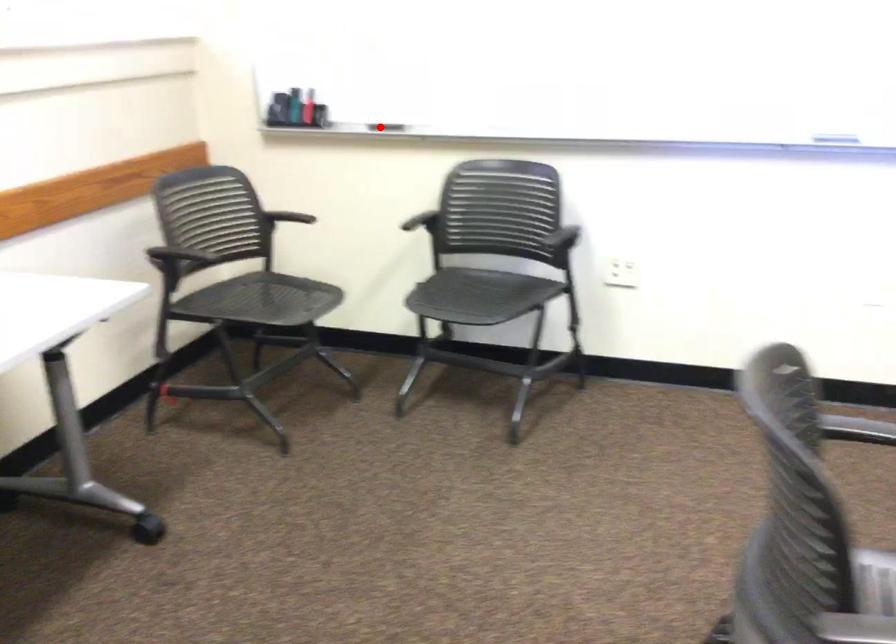
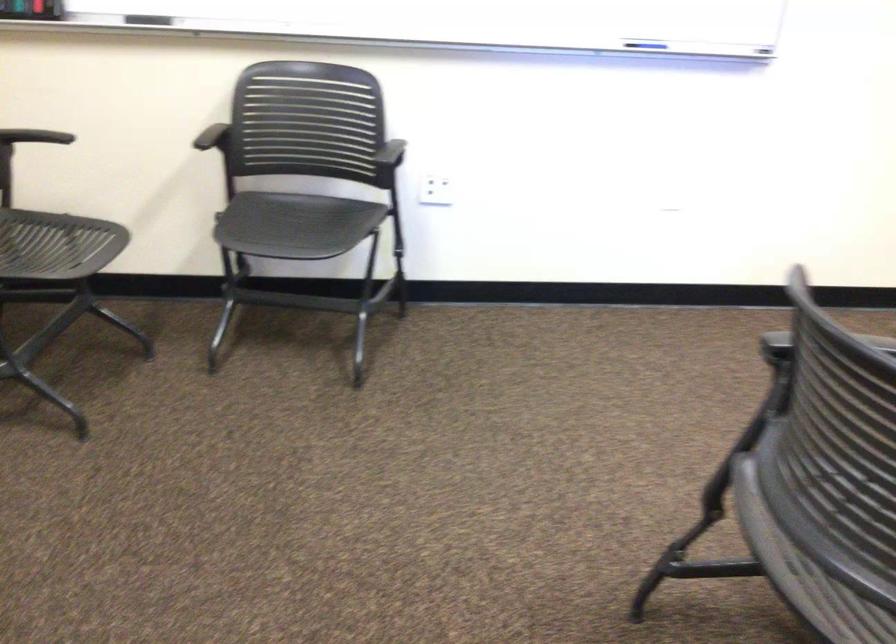
Where in the second image is the point corresponding to the highlighted location from the first image?

(148, 20)